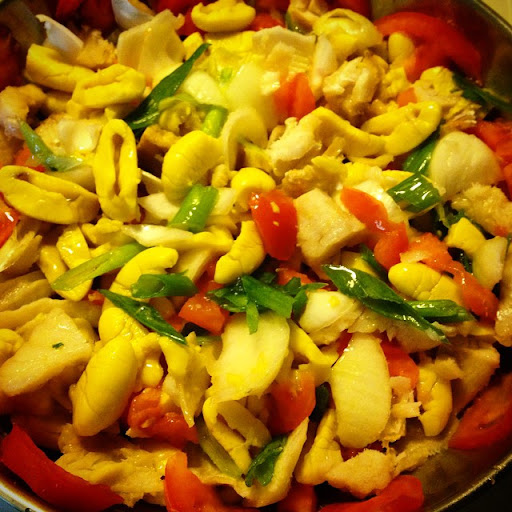
Locate an element on the screen. bowl is located at coordinates (x=495, y=19), (x=487, y=473), (x=23, y=500).